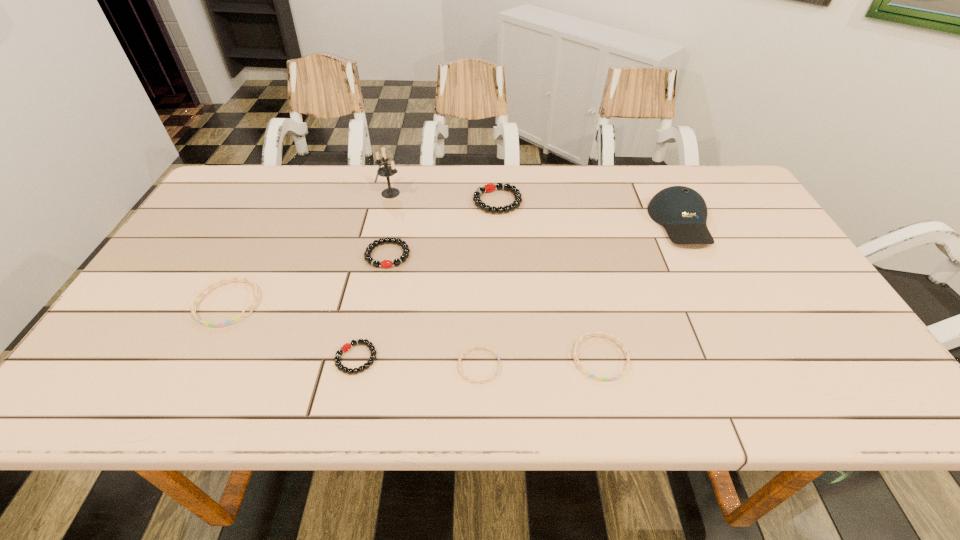
Locate an element on the screen. The width and height of the screenshot is (960, 540). free space that satisfies the following two spatial constraints: 1. on the surface of the third farthest bracelet showing star-shaped elements; 2. on the left side of the nearest black bracelet is located at coordinates (200, 358).

You are a GUI agent. You are given a task and a screenshot of the screen. Output one action in this format:
    pyautogui.click(x=<x>, y=<y>)
    Task: Click on the vacant space that satisfies the following two spatial constraints: 1. on the front-facing side of the baseball cap; 2. on the surface of the shortest bracelet showing star-shaped elements
    
    Given the screenshot: What is the action you would take?
    pyautogui.click(x=752, y=366)